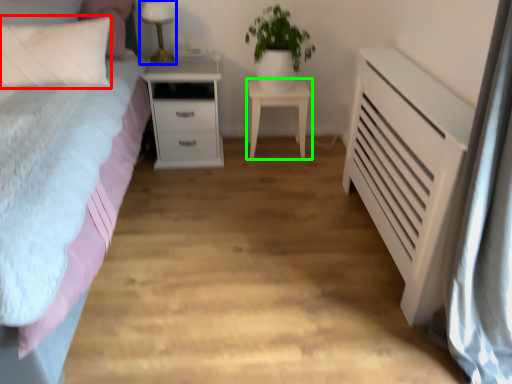
Question: Considering the real-world distances, which object is closest to pillow (highlighted by a red box)? table lamp (highlighted by a blue box) or nightstand (highlighted by a green box).

Choices:
 (A) table lamp
 (B) nightstand

Answer: (A)